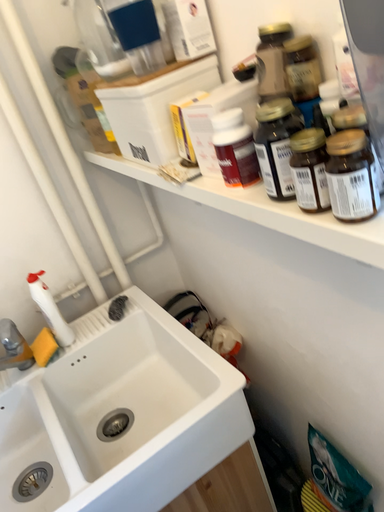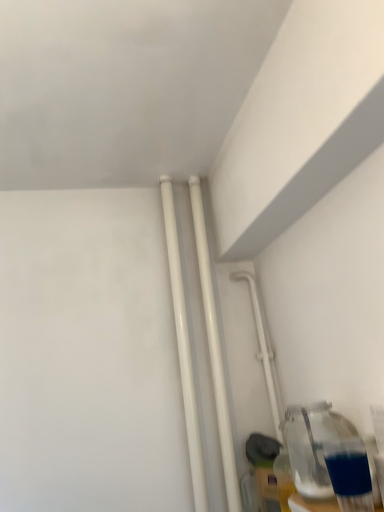
Question: Which way did the camera rotate in the video?

Choices:
 (A) rotated left
 (B) rotated right

Answer: (A)